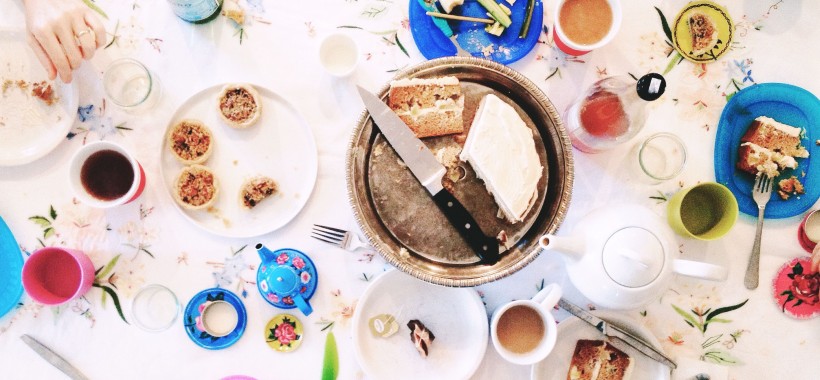
The image size is (820, 380). In order to click on cup in this screenshot , I will do `click(549, 326)`.